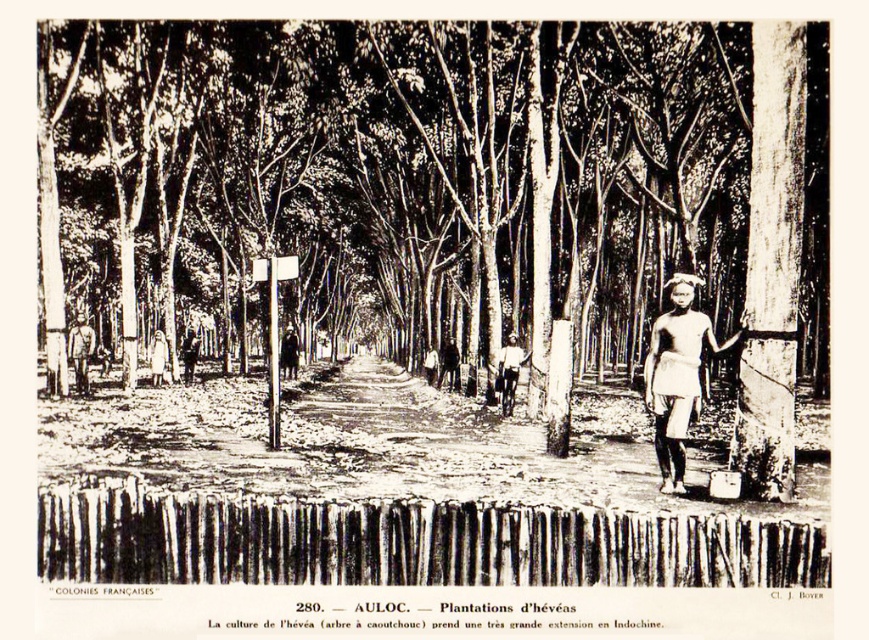
You are a photographer standing in the middle of the path between the white cotton shirt at center and the light brown wooden post at left. You want to take a photo that includes both objects. Which object should you position closer to the edge of the frame to ensure both fit in the shot?

You should position the white cotton shirt at center closer to the edge of the frame because it occupies less space than the light brown wooden post at left, allowing both to fit within the photo.

You are a photographer standing at the center of the path between the smooth bark tree at center and the white cotton shirt at center. Which object is taller?

The smooth bark tree at center is taller than the white cotton shirt at center.